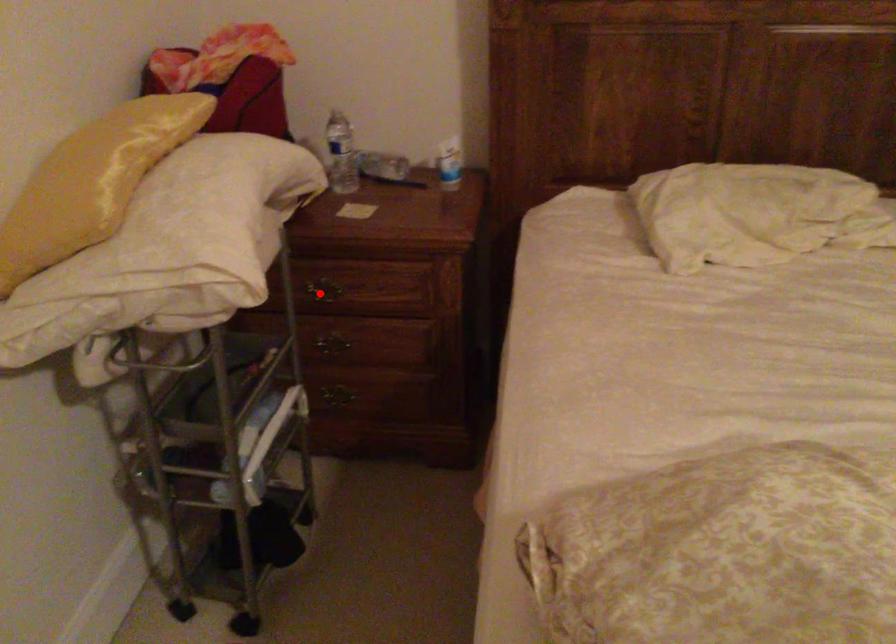
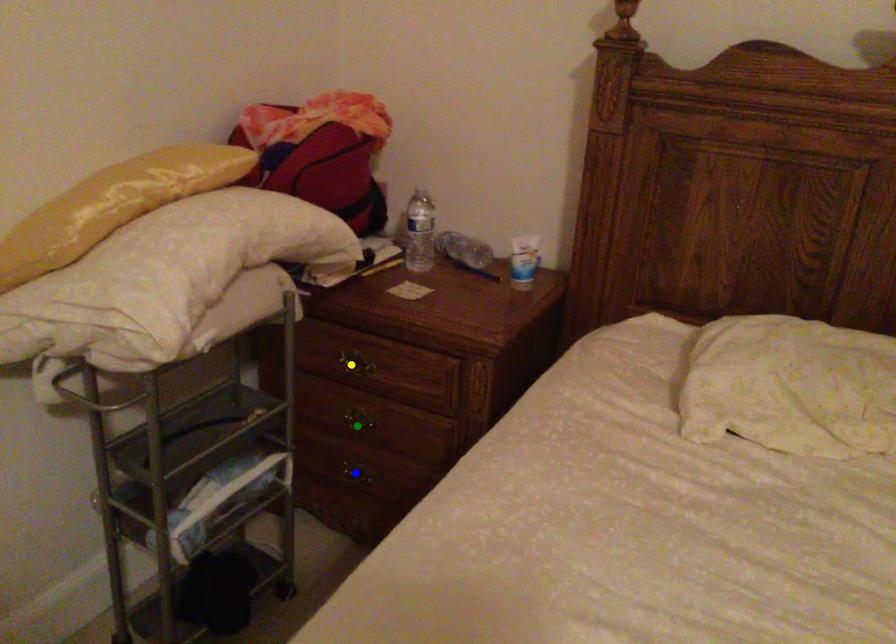
Question: I am providing you with two images of the same scene from different viewpoints. A red point is marked on the first image. You are given multiple points on the second image. In image 2, which mark is for the same physical point as the one in image 1?

Choices:
 (A) blue point
 (B) yellow point
 (C) green point

Answer: (B)